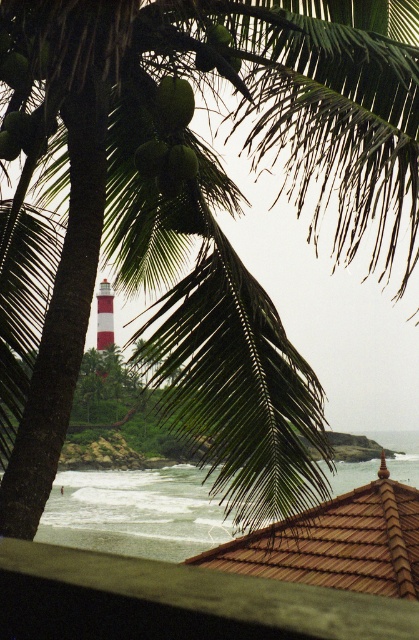
Between point (108, 326) and point (220, 38), which one is positioned behind?

The point (108, 326) is more distant.

What are the coordinates of `white striped tower at center` in the screenshot? It's located at (105, 316).

Which is above, green matte coconut at upper center or white striped tower at center?

green matte coconut at upper center

The height and width of the screenshot is (640, 419). I want to click on green matte coconut at upper center, so click(173, 104).

Find the location of a particular element. green matte coconut at upper center is located at coordinates (173, 104).

Which is more to the right, brown tile roof at lower center or green matte coconut at center?

Positioned to the right is brown tile roof at lower center.

Can you confirm if brown tile roof at lower center is positioned to the left of green matte coconut at center?

Incorrect, brown tile roof at lower center is not on the left side of green matte coconut at center.

Measure the distance between point (x=302, y=536) and camera.

The distance of point (x=302, y=536) from camera is 8.64 meters.

Find the location of a particular element. This screenshot has height=640, width=419. brown tile roof at lower center is located at coordinates (336, 541).